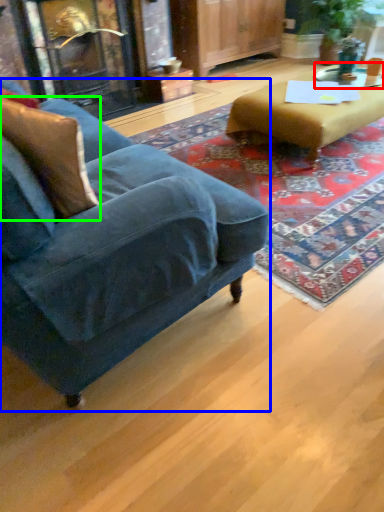
Question: Considering the real-world distances, which object is farthest from side table (highlighted by a red box)? studio couch (highlighted by a blue box) or pillow (highlighted by a green box)?

Choices:
 (A) studio couch
 (B) pillow

Answer: (B)